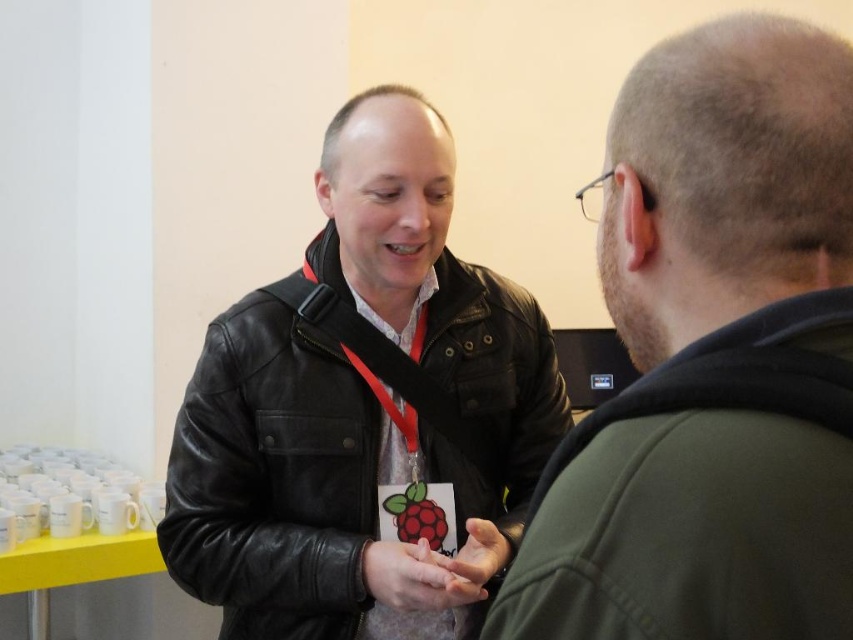
Question: Which of the following is the closest to the observer?

Choices:
 (A) matte black leather jacket at center
 (B) black leather jacket at center
 (C) white matte neck at center

Answer: (A)

Question: Which point is farther to the camera?

Choices:
 (A) (341, 246)
 (B) (595, 516)
 (C) (506, 337)

Answer: (C)

Question: Is matte black leather jacket at center to the left of black leather jacket at center from the viewer's perspective?

Choices:
 (A) yes
 (B) no

Answer: (B)

Question: Which object is farther from the camera taking this photo?

Choices:
 (A) matte black leather jacket at center
 (B) white matte neck at center

Answer: (B)

Question: Is matte black leather jacket at center further to camera compared to black leather jacket at center?

Choices:
 (A) yes
 (B) no

Answer: (B)

Question: Does matte black leather jacket at center have a lesser width compared to white matte neck at center?

Choices:
 (A) no
 (B) yes

Answer: (A)